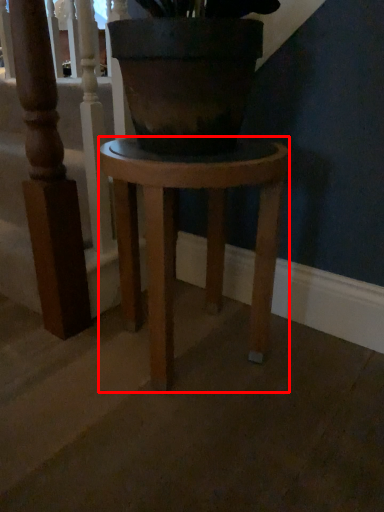
Question: From the image's perspective, where is stool (annotated by the red box) located relative to rail?

Choices:
 (A) above
 (B) below

Answer: (B)